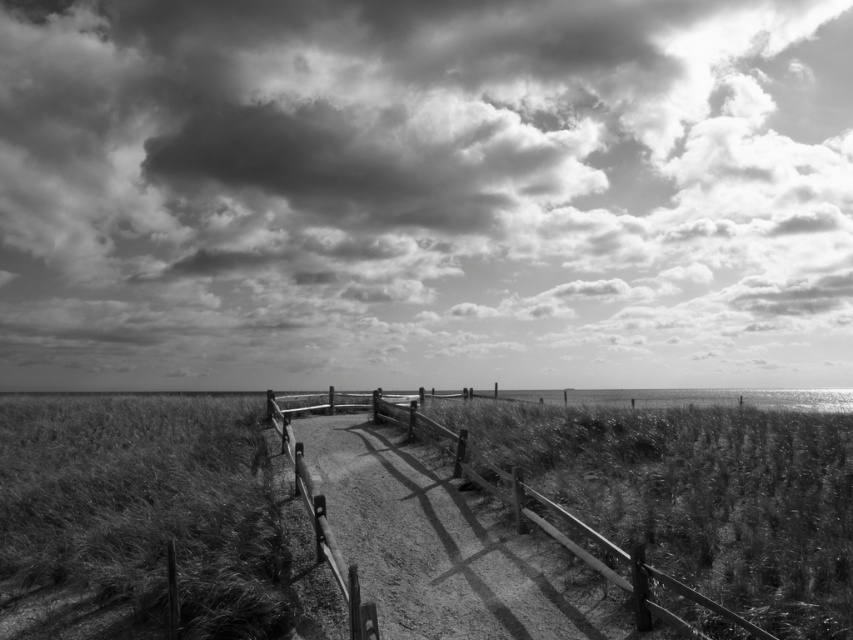
You are a photographer planning to capture the cloudy sky at upper center and the coarse textured grass at lower left in a single frame. Which object will occupy more horizontal space in the photo?

The cloudy sky at upper center will occupy more horizontal space in the photo because its width surpasses that of the coarse textured grass at lower left.

You are a photographer standing at the edge of the sandy path. You want to capture a shot of the coarse textured grass at lower left and the wooden fence at center. Which object is closer to the camera?

The coarse textured grass at lower left is positioned under the wooden fence at center, meaning it is closer to the camera.

You are a photographer planning to capture the cloudy sky at upper center and the coarse textured grass at lower left in a single frame. Based on their heights, which object will occupy more vertical space in the photo?

The cloudy sky at upper center has a greater height compared to the coarse textured grass at lower left, so it will occupy more vertical space in the photo.